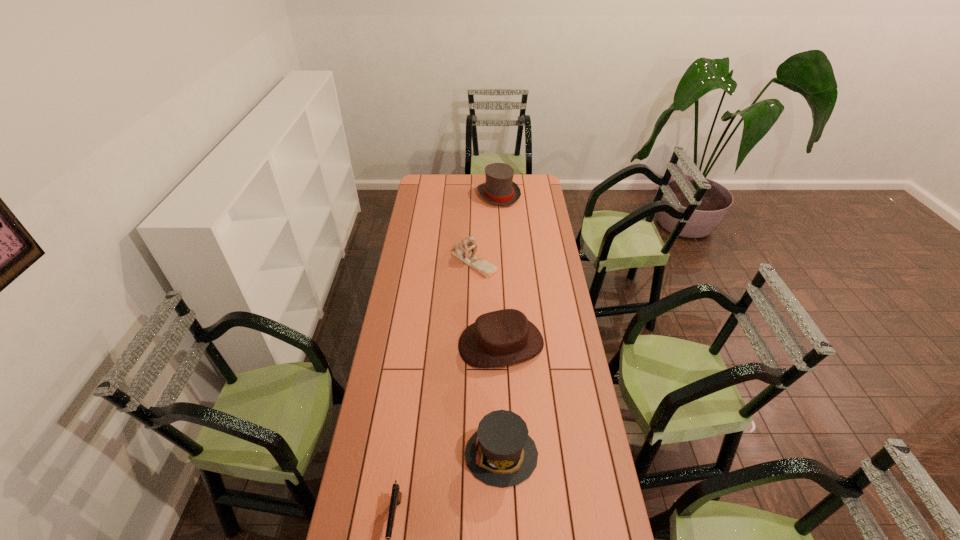
The height and width of the screenshot is (540, 960). Find the location of `object at the far edge`. object at the far edge is located at coordinates (499, 189).

This screenshot has height=540, width=960. Find the location of `object present at the far right corner`. object present at the far right corner is located at coordinates (499, 189).

Image resolution: width=960 pixels, height=540 pixels. Identify the location of vacant region at the far edge. (452, 180).

In the image, there is a desktop. At what (x,y) coordinates should I click in order to perform the action: click on vacant space at the left edge. Please return your answer as a coordinate pair (x, y). This screenshot has height=540, width=960. Looking at the image, I should click on (420, 244).

In the image, there is a desktop. At what (x,y) coordinates should I click in order to perform the action: click on vacant space at the right edge. Please return your answer as a coordinate pair (x, y). Looking at the image, I should click on (566, 298).

The height and width of the screenshot is (540, 960). I want to click on empty space that is in between the third farthest object and the farthest object, so click(x=500, y=269).

Locate an element on the screen. This screenshot has height=540, width=960. vacant point located between the farthest object and the figurine is located at coordinates (486, 228).

Locate which object ranks third in proximity to the leftmost object. Please provide its 2D coordinates. Your answer should be formatted as a tuple, i.e. [(x, y)], where the tuple contains the x and y coordinates of a point satisfying the conditions above.

[(463, 249)]

Locate which object is the third closest to the second nearest hat. Please provide its 2D coordinates. Your answer should be formatted as a tuple, i.e. [(x, y)], where the tuple contains the x and y coordinates of a point satisfying the conditions above.

[(396, 495)]

Identify which hat is located as the second nearest to the farthest hat. Please provide its 2D coordinates. Your answer should be formatted as a tuple, i.e. [(x, y)], where the tuple contains the x and y coordinates of a point satisfying the conditions above.

[(500, 453)]